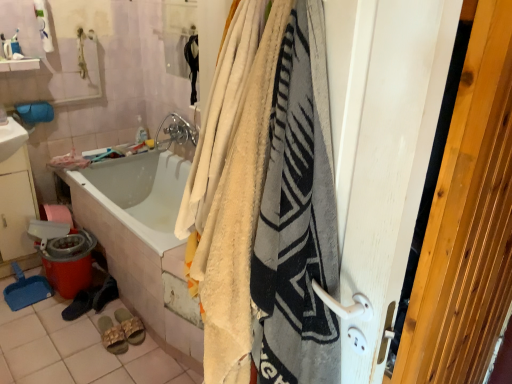
The width and height of the screenshot is (512, 384). Find the location of `free space in front of black suede shoes at lower left, which is counted as the third footwear, starting from the right`. free space in front of black suede shoes at lower left, which is counted as the third footwear, starting from the right is located at coordinates (86, 322).